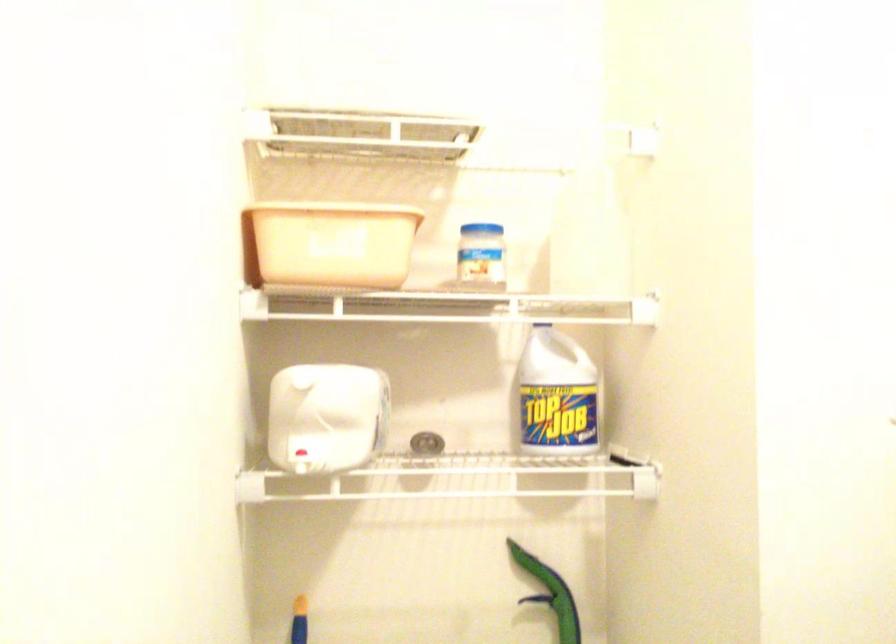
Where would you unscrew the blue jar lid? Please return your answer as a coordinate pair (x, y).

(479, 225)